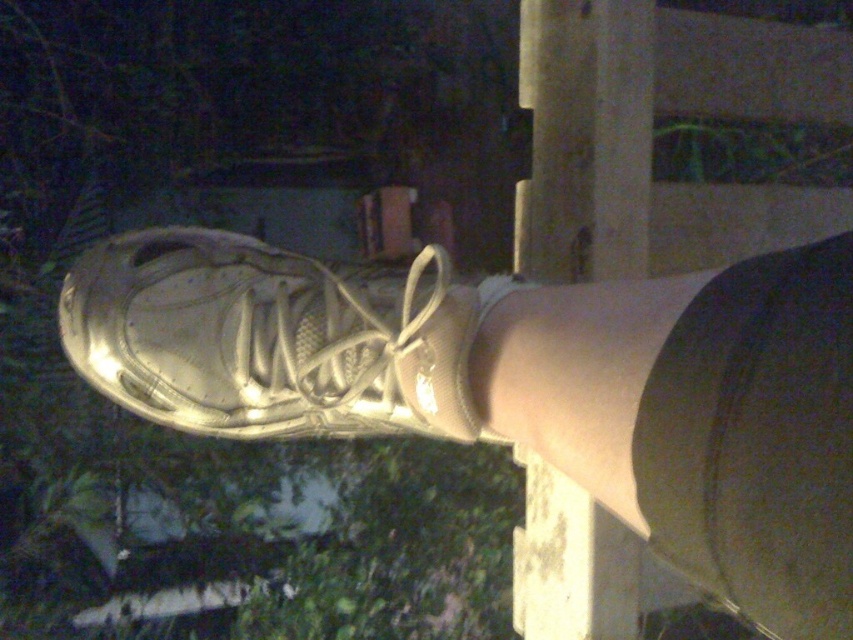
Question: Is metallic gold shoe at center wider than smooth concrete pole at center?

Choices:
 (A) no
 (B) yes

Answer: (B)

Question: Does metallic gold shoe at center have a smaller size compared to white mesh shoe at center?

Choices:
 (A) yes
 (B) no

Answer: (B)

Question: Which object is closer to the camera taking this photo?

Choices:
 (A) smooth concrete pole at center
 (B) metallic gold shoe at center

Answer: (B)

Question: Is white mesh shoe at center wider than smooth concrete pole at center?

Choices:
 (A) no
 (B) yes

Answer: (B)

Question: Estimate the real-world distances between objects in this image. Which object is farther from the metallic gold shoe at center?

Choices:
 (A) smooth concrete pole at center
 (B) white mesh shoe at center

Answer: (A)

Question: Which object is closer to the camera taking this photo?

Choices:
 (A) white mesh shoe at center
 (B) metallic gold shoe at center

Answer: (B)